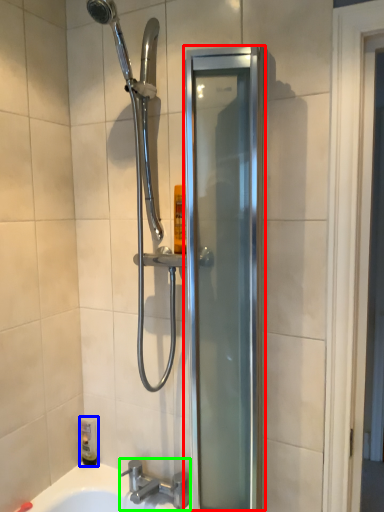
Question: Based on their relative distances, which object is farther from screen door (highlighted by a red box)? Choose from toiletry (highlighted by a blue box) and tap (highlighted by a green box).

Choices:
 (A) toiletry
 (B) tap

Answer: (A)